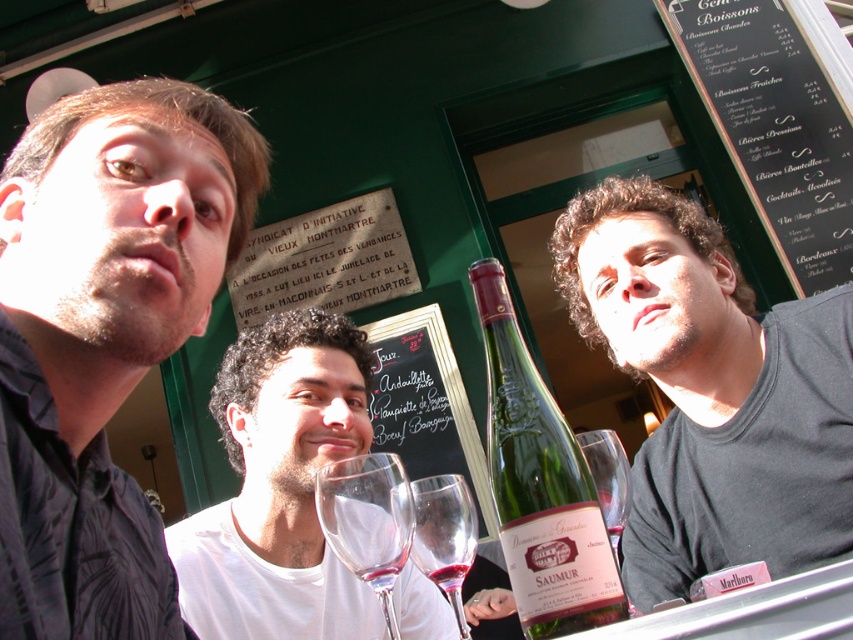
Is dark gray shirt at left further to the viewer compared to white matte wine glass at center?

No, it is not.

Identify the location of dark gray shirt at left. (103, 336).

Does point (59, 435) come in front of point (289, 465)?

Yes.

The image size is (853, 640). Identify the location of dark gray shirt at left. (103, 336).

Which of these two, dark gray shirt at left or transparent glass wine glass at center, stands taller?

With more height is dark gray shirt at left.

Which is in front, point (132, 538) or point (373, 496)?

Point (373, 496)

Find the location of a particular element. This screenshot has width=853, height=640. dark gray shirt at left is located at coordinates (103, 336).

Which is below, dark gray shirt at left or black matte shirt at right?

black matte shirt at right is below.

Who is higher up, dark gray shirt at left or black matte shirt at right?

dark gray shirt at left is higher up.

The image size is (853, 640). Identify the location of dark gray shirt at left. (103, 336).

This screenshot has height=640, width=853. In order to click on dark gray shirt at left in this screenshot , I will do `click(103, 336)`.